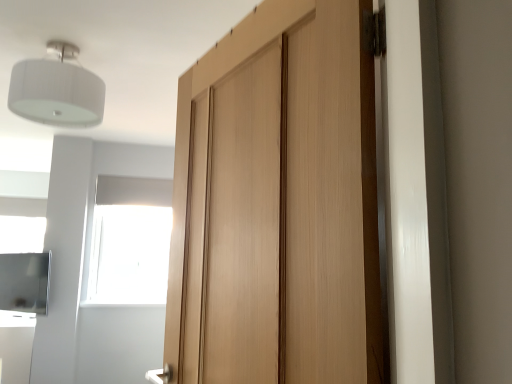
Question: Do you think white fabric lampshade at upper left is within satin silver cabinet at lower left, or outside of it?

Choices:
 (A) inside
 (B) outside

Answer: (B)

Question: In terms of width, does white fabric lampshade at upper left look wider or thinner when compared to satin silver cabinet at lower left?

Choices:
 (A) thin
 (B) wide

Answer: (B)

Question: Estimate the real-world distances between objects in this image. Which object is closer to the light wood door at center?

Choices:
 (A) transparent glass window at upper center
 (B) white fabric lampshade at upper left
 (C) satin silver cabinet at lower left

Answer: (B)

Question: Considering the real-world distances, which object is farthest from the transparent glass window at upper center?

Choices:
 (A) satin silver cabinet at lower left
 (B) white fabric lampshade at upper left
 (C) light wood door at center

Answer: (C)